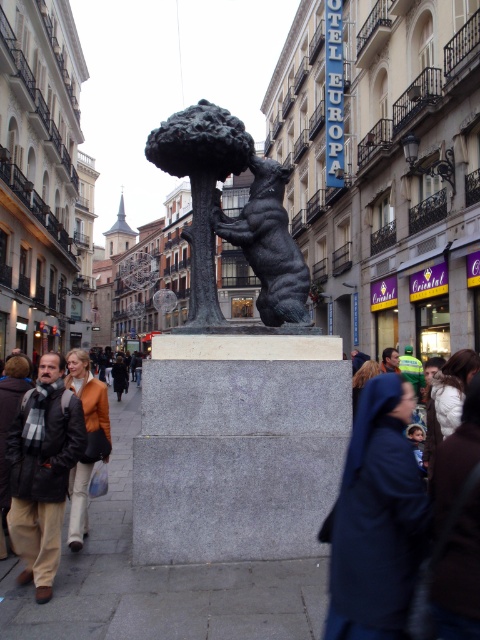
Question: Is polished bronze bear at center bigger than orange leather jacket at lower left?

Choices:
 (A) no
 (B) yes

Answer: (B)

Question: Which point is closer to the camera?

Choices:
 (A) (278, 234)
 (B) (69, 413)
 (C) (72, 477)
 (D) (384, 611)

Answer: (D)

Question: Which of the following is the closest to the observer?

Choices:
 (A) black wool coat at center
 (B) bronze bear at center
 (C) dark brown leather jacket at lower left
 (D) orange leather jacket at lower left

Answer: (C)

Question: Is bronze bear at center thinner than dark brown hair at center?

Choices:
 (A) no
 (B) yes

Answer: (B)

Question: Does orange leather jacket at lower left appear under dark brown hair at center?

Choices:
 (A) yes
 (B) no

Answer: (A)

Question: Among these points, which one is nearest to the camera?

Choices:
 (A) (163, 138)
 (B) (395, 349)
 (C) (118, 369)

Answer: (A)